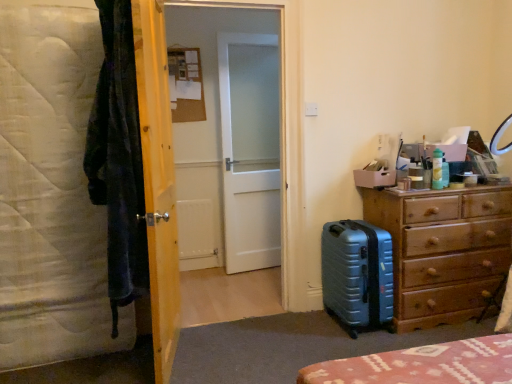
Locate an element on the screen. The height and width of the screenshot is (384, 512). free space in front of white quilted mattress at left is located at coordinates (59, 372).